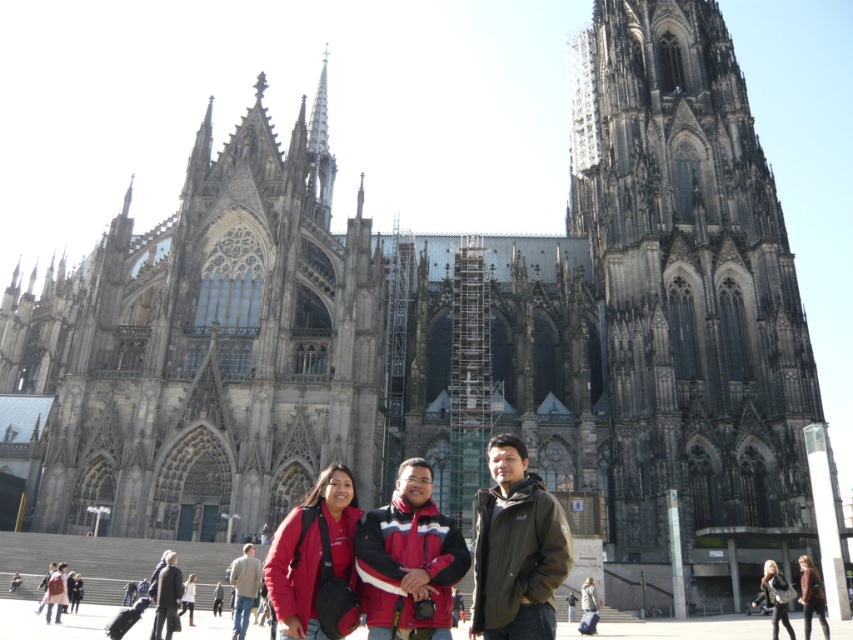
Question: Does matte red coat at lower center come behind matte red jacket at lower left?

Choices:
 (A) no
 (B) yes

Answer: (A)

Question: Which is farther from the dark olive-green jacket at center?

Choices:
 (A) matte black jacket at center
 (B) matte red jacket at center
 (C) matte brown coat at center
 (D) matte red jacket at lower left

Answer: (D)

Question: Estimate the real-world distances between objects in this image. Which object is farther from the red and black jacket at center?

Choices:
 (A) matte red jacket at center
 (B) matte black jacket at center
 (C) dark olive-green jacket at center

Answer: (B)

Question: Can you confirm if dark olive-green jacket at center is smaller than matte brown coat at center?

Choices:
 (A) no
 (B) yes

Answer: (A)

Question: Is red and black jacket at center wider than matte brown coat at center?

Choices:
 (A) no
 (B) yes

Answer: (A)

Question: Among these objects, which one is nearest to the camera?

Choices:
 (A) red and black jacket at center
 (B) dark olive-green jacket at center
 (C) matte black jacket at center
 (D) matte red coat at lower center

Answer: (B)